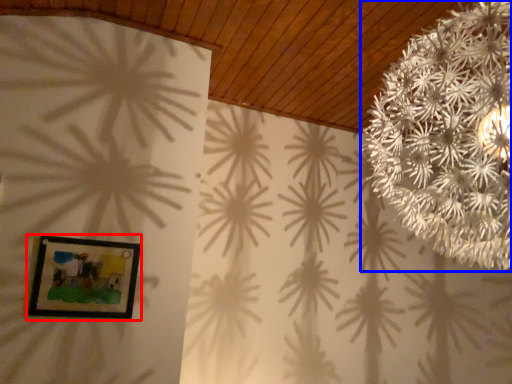
Question: Among these objects, which one is farthest to the camera, picture frame (highlighted by a red box) or flower (highlighted by a blue box)?

Choices:
 (A) picture frame
 (B) flower

Answer: (A)